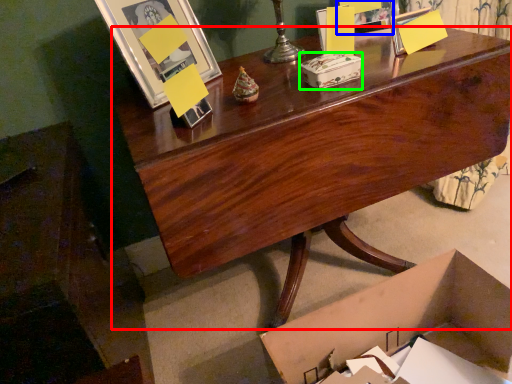
Question: Which is nearer to the desk (highlighted by a red box)? picture frame (highlighted by a blue box) or box (highlighted by a green box).

Choices:
 (A) picture frame
 (B) box

Answer: (B)